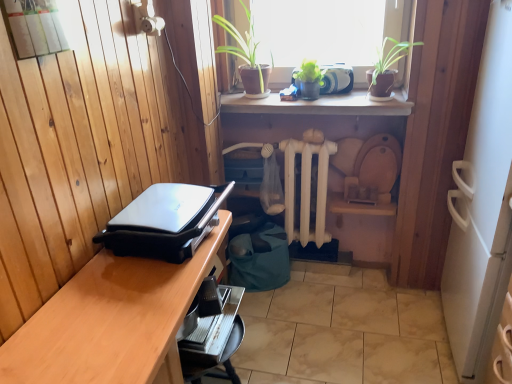
Question: Is green matte plant at upper center positioned with its back to white wooden radiator at center?

Choices:
 (A) yes
 (B) no

Answer: (B)

Question: Is green matte plant at upper center bigger than white wooden radiator at center?

Choices:
 (A) no
 (B) yes

Answer: (B)

Question: Does green matte plant at upper center appear on the right side of white wooden radiator at center?

Choices:
 (A) yes
 (B) no

Answer: (B)

Question: Can you confirm if green matte plant at upper center is shorter than white wooden radiator at center?

Choices:
 (A) no
 (B) yes

Answer: (B)

Question: Is white wooden radiator at center completely or partially inside green matte plant at upper center?

Choices:
 (A) no
 (B) yes

Answer: (A)

Question: From the image's perspective, is green matte plant at upper center over white wooden radiator at center?

Choices:
 (A) yes
 (B) no

Answer: (A)

Question: Considering the relative sizes of wooden desk at lower left and green leafy plants at upper center in the image provided, is wooden desk at lower left wider than green leafy plants at upper center?

Choices:
 (A) yes
 (B) no

Answer: (A)

Question: Is wooden desk at lower left beside green leafy plants at upper center?

Choices:
 (A) no
 (B) yes

Answer: (A)

Question: Is wooden desk at lower left shorter than green leafy plants at upper center?

Choices:
 (A) yes
 (B) no

Answer: (B)

Question: Does wooden desk at lower left lie behind green leafy plants at upper center?

Choices:
 (A) yes
 (B) no

Answer: (B)

Question: Is wooden desk at lower left positioned with its back to green leafy plants at upper center?

Choices:
 (A) no
 (B) yes

Answer: (A)

Question: From a real-world perspective, is wooden desk at lower left located beneath green leafy plants at upper center?

Choices:
 (A) yes
 (B) no

Answer: (A)

Question: Does green matte plant at upper center come behind green matte plant at upper center?

Choices:
 (A) yes
 (B) no

Answer: (A)